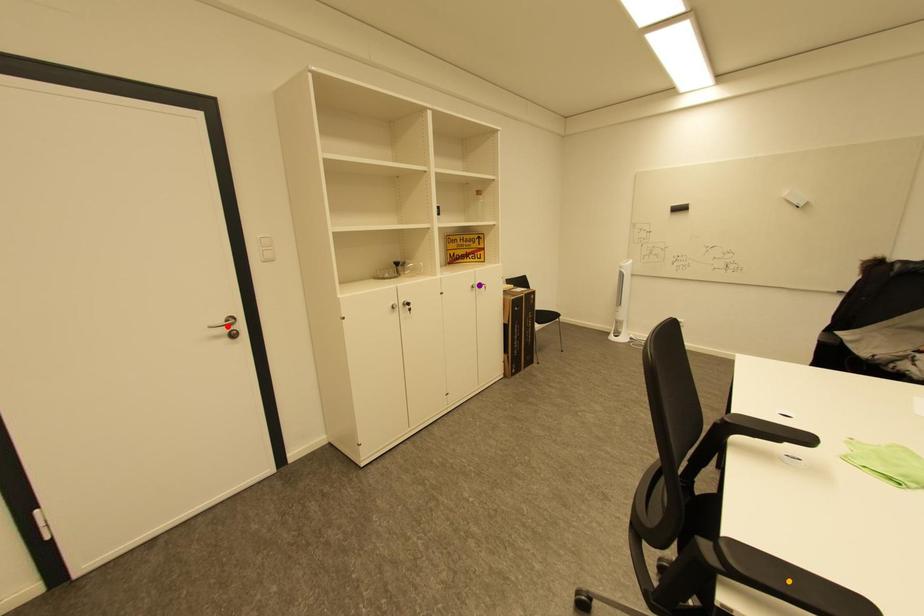
Order these from nearest to farthest:
1. purple point
2. red point
3. orange point

orange point, red point, purple point